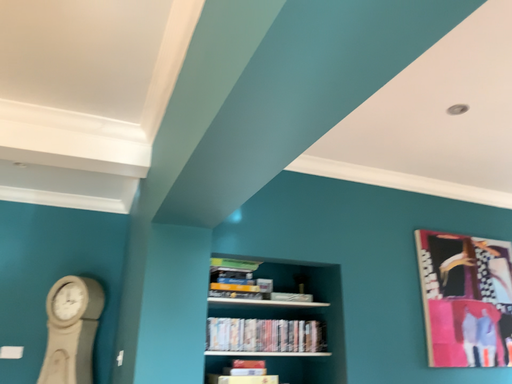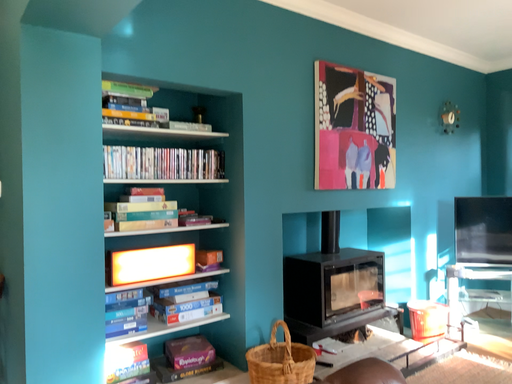
Question: Which way did the camera rotate in the video?

Choices:
 (A) rotated upward
 (B) rotated downward

Answer: (B)